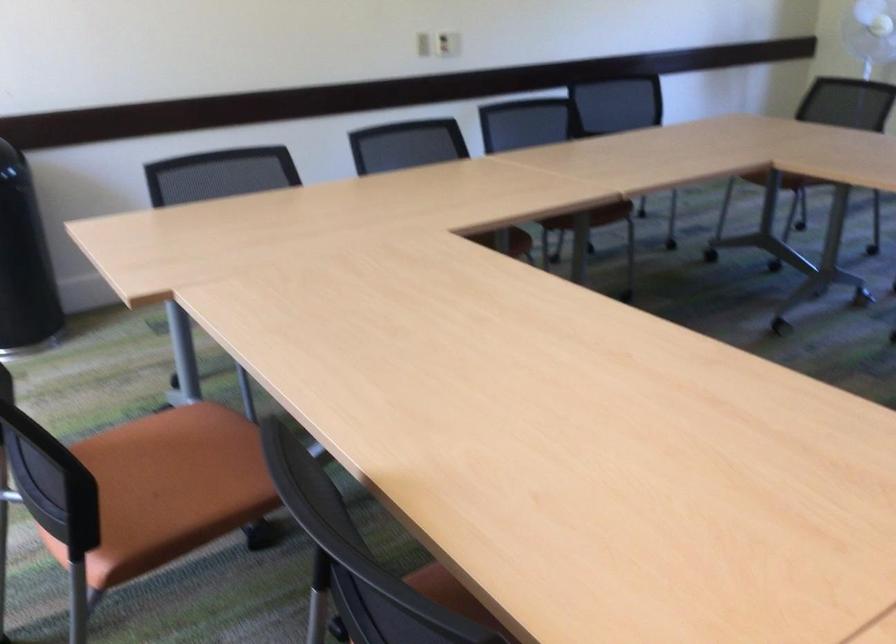
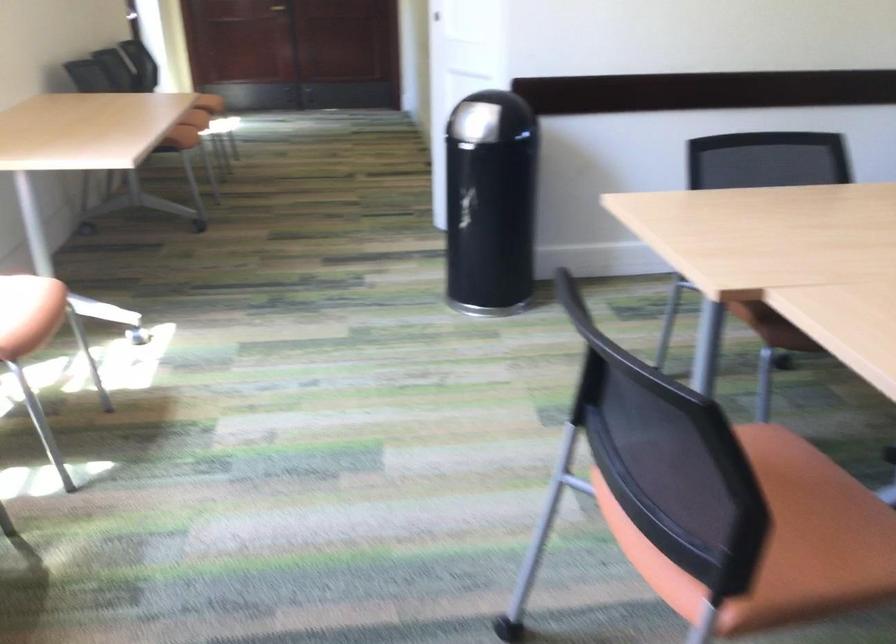
Find the pixel in the second image that matches (x=185, y=502) in the first image.

(782, 540)